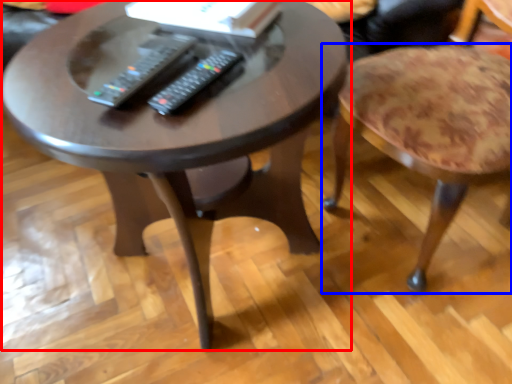
Question: Which of the following is the closest to the observer, coffee table (highlighted by a red box) or stool (highlighted by a blue box)?

Choices:
 (A) coffee table
 (B) stool

Answer: (A)